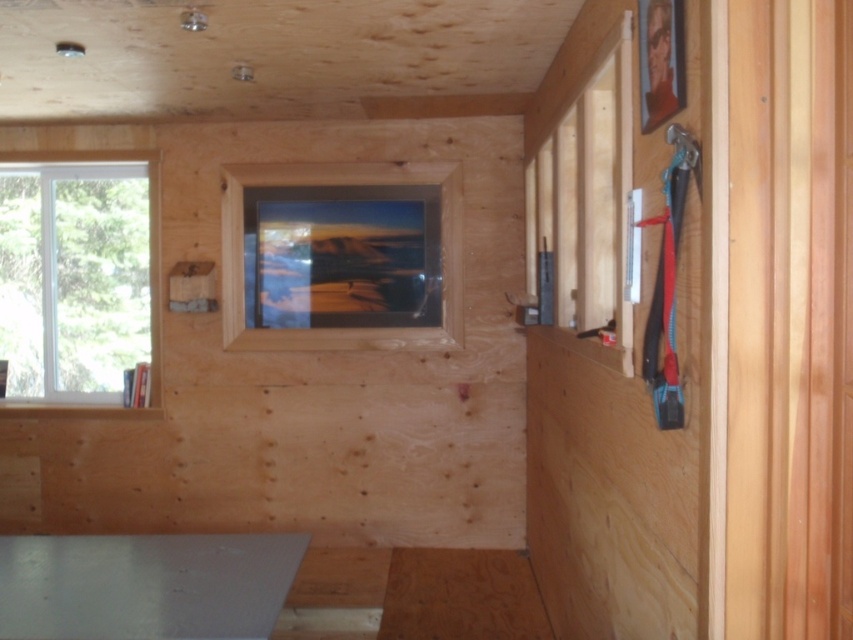
Can you confirm if white glossy table at lower left is smaller than matte wooden frame at center?

Yes.

Which is more to the right, white glossy table at lower left or matte wooden frame at center?

matte wooden frame at center is more to the right.

What are the coordinates of `white glossy table at lower left` in the screenshot? It's located at pyautogui.click(x=144, y=586).

Where is `white plastic window at left`? white plastic window at left is located at coordinates (80, 280).

Is white plastic window at left shorter than white glossy table at lower left?

No, white plastic window at left is not shorter than white glossy table at lower left.

The image size is (853, 640). Find the location of `white plastic window at left`. white plastic window at left is located at coordinates (80, 280).

Locate an element on the screen. The image size is (853, 640). white plastic window at left is located at coordinates (80, 280).

Measure the distance between white plastic window at left and camera.

They are 13.20 feet apart.

Does white plastic window at left appear on the right side of matte wooden frame at center?

Incorrect, white plastic window at left is not on the right side of matte wooden frame at center.

Image resolution: width=853 pixels, height=640 pixels. In order to click on white plastic window at left in this screenshot , I will do point(80,280).

You are a GUI agent. You are given a task and a screenshot of the screen. Output one action in this format:
    pyautogui.click(x=<x>, y=<y>)
    Task: Click on the white plastic window at left
    
    Given the screenshot: What is the action you would take?
    pyautogui.click(x=80, y=280)